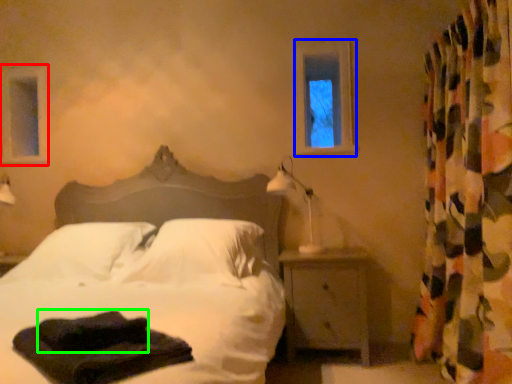
Question: Which is farther away from window frame (highlighted by a red box)? window frame (highlighted by a blue box) or material (highlighted by a green box)?

Choices:
 (A) window frame
 (B) material

Answer: (B)